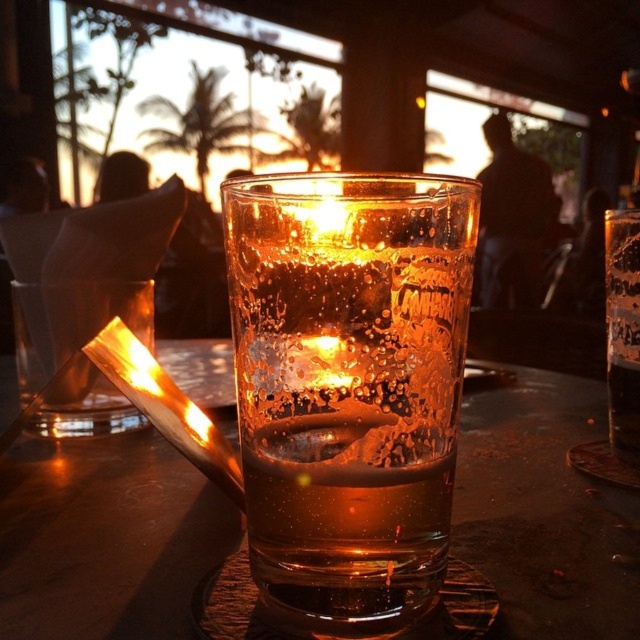
Question: Is transparent glass at center smaller than translucent glass beer at center?

Choices:
 (A) yes
 (B) no

Answer: (B)

Question: Observing the image, what is the correct spatial positioning of translucent glass at center in reference to translucent glass beer at center?

Choices:
 (A) above
 (B) below

Answer: (B)

Question: Which of the following is the closest to the observer?

Choices:
 (A) translucent glass beer at center
 (B) translucent glass at center

Answer: (B)

Question: Which is farther from the transparent glass at center?

Choices:
 (A) translucent glass at center
 (B) translucent glass beer at center

Answer: (B)

Question: Which point is farther from the camera taking this photo?

Choices:
 (A) click(76, 634)
 (B) click(387, 532)
 (C) click(637, 355)

Answer: (C)

Question: Is translucent glass at center to the left of translucent glass beer at center from the viewer's perspective?

Choices:
 (A) no
 (B) yes

Answer: (B)